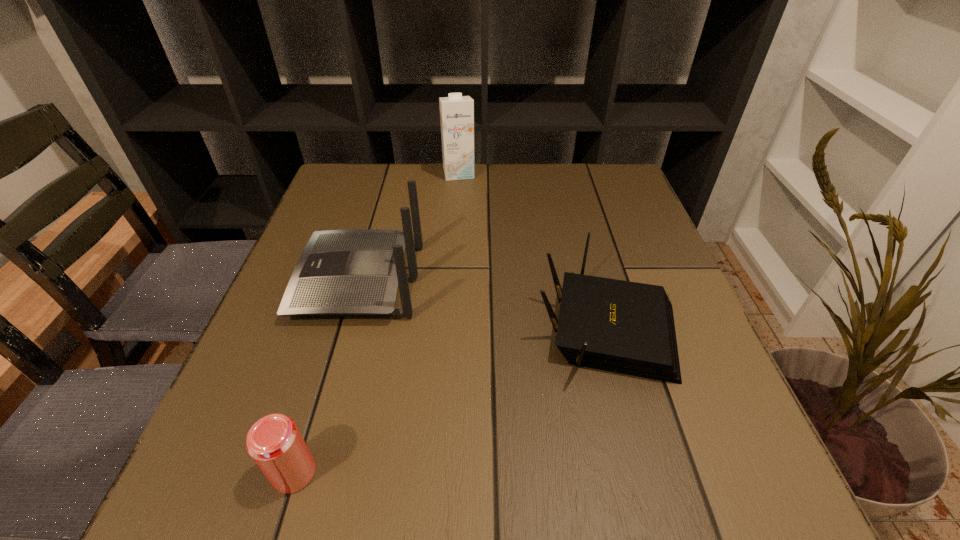
Identify the location of free region at the far right corner. (624, 203).

You are a GUI agent. You are given a task and a screenshot of the screen. Output one action in this format:
    pyautogui.click(x=<x>, y=<y>)
    Task: Click on the vacant space in between the taller router and the beer can
    This screenshot has width=960, height=540.
    Given the screenshot: What is the action you would take?
    pyautogui.click(x=326, y=376)

This screenshot has width=960, height=540. What are the coordinates of `vacant space in between the second tallest object and the shorter router` in the screenshot? It's located at [x=483, y=301].

Where is `free point between the right router and the nearest object`? free point between the right router and the nearest object is located at coordinates (450, 398).

Locate an element on the screen. empty space that is in between the third object from left to right and the shorter router is located at coordinates (533, 248).

Where is `free space between the carton and the nearest object`? free space between the carton and the nearest object is located at coordinates (376, 323).

You are a GUI agent. You are given a task and a screenshot of the screen. Output one action in this format:
    pyautogui.click(x=<x>, y=<y>)
    Task: Click on the vacant area that lies between the second object from right to left and the nearest object
    The image size is (960, 540).
    Given the screenshot: What is the action you would take?
    pyautogui.click(x=376, y=323)

The width and height of the screenshot is (960, 540). Find the location of `vacant area between the nearest object and the left router`. vacant area between the nearest object and the left router is located at coordinates (326, 376).

Identify which object is the nearest to the left router. Please provide its 2D coordinates. Your answer should be formatted as a tuple, i.e. [(x, y)], where the tuple contains the x and y coordinates of a point satisfying the conditions above.

[(625, 327)]

Locate which object ranks third in proximity to the beer can. Please provide its 2D coordinates. Your answer should be formatted as a tuple, i.e. [(x, y)], where the tuple contains the x and y coordinates of a point satisfying the conditions above.

[(456, 111)]